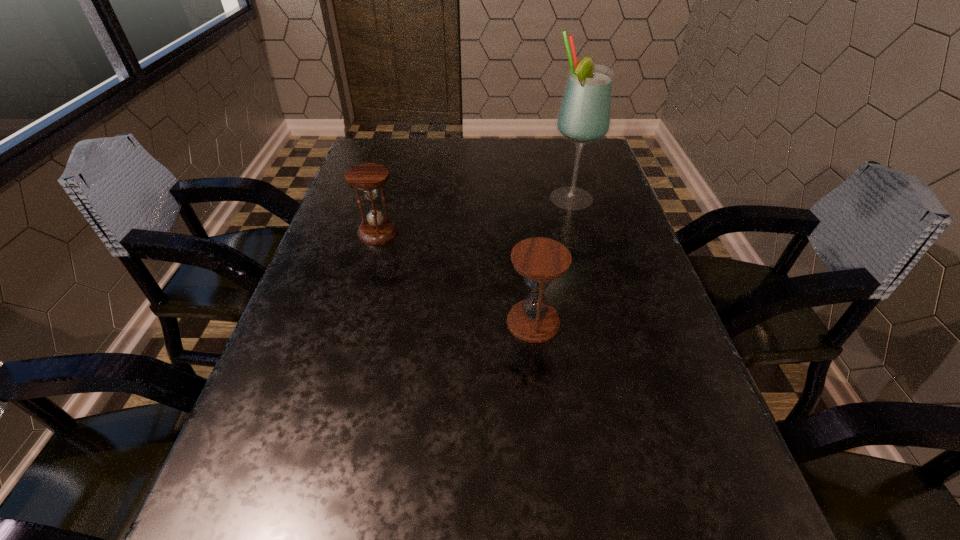
I want to click on free spot that satisfies the following two spatial constraints: 1. on the back side of the tallest object; 2. on the right side of the leftmost object, so click(x=387, y=200).

Find the location of a particular element. Image resolution: width=960 pixels, height=540 pixels. vacant space that satisfies the following two spatial constraints: 1. on the front side of the nearest object; 2. on the left side of the left hourglass is located at coordinates (353, 322).